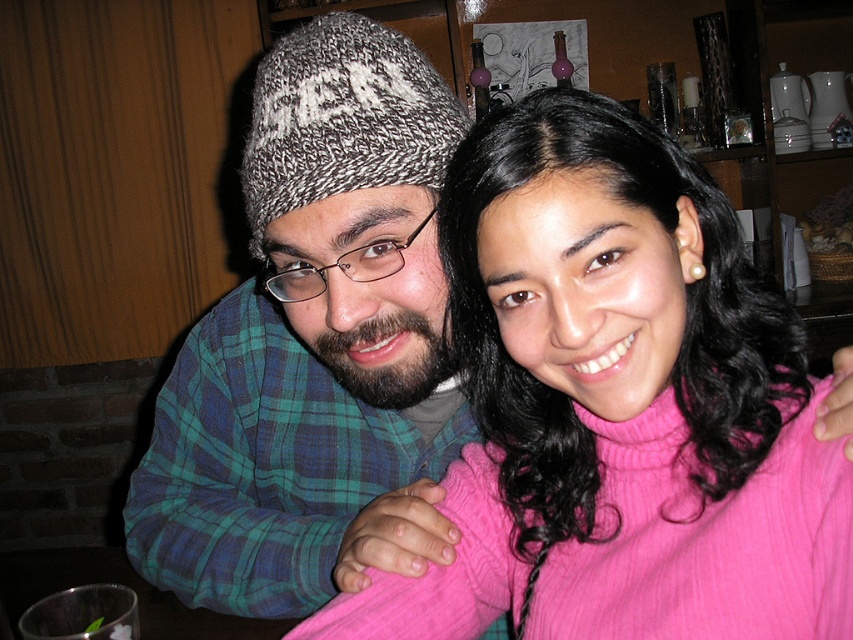
Question: Which object appears closest to the camera in this image?

Choices:
 (A) knitted gray and white hat at upper left
 (B) knitted wool beanie at upper left

Answer: (A)

Question: Is the position of knitted wool beanie at upper left more distant than that of knitted gray and white hat at upper left?

Choices:
 (A) yes
 (B) no

Answer: (A)

Question: Which object appears closest to the camera in this image?

Choices:
 (A) knitted gray and white hat at upper left
 (B) knitted wool beanie at upper left

Answer: (A)

Question: Is knitted wool beanie at upper left smaller than knitted gray and white hat at upper left?

Choices:
 (A) yes
 (B) no

Answer: (B)

Question: Is knitted wool beanie at upper left thinner than knitted gray and white hat at upper left?

Choices:
 (A) yes
 (B) no

Answer: (B)

Question: Among these points, which one is nearest to the camera?

Choices:
 (A) (277, 124)
 (B) (328, 54)

Answer: (A)